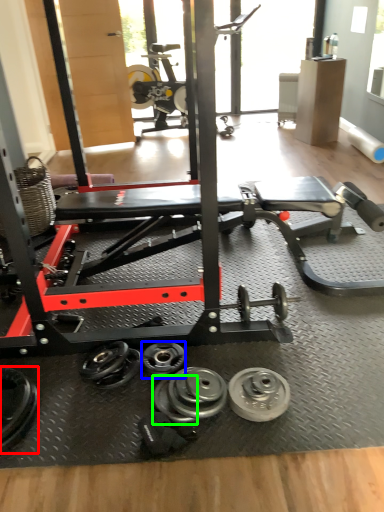
Question: Considering the real-world distances, which object is farthest from dumbbell (highlighted by a red box)? dumbbell (highlighted by a blue box) or wheel (highlighted by a green box)?

Choices:
 (A) dumbbell
 (B) wheel

Answer: (A)